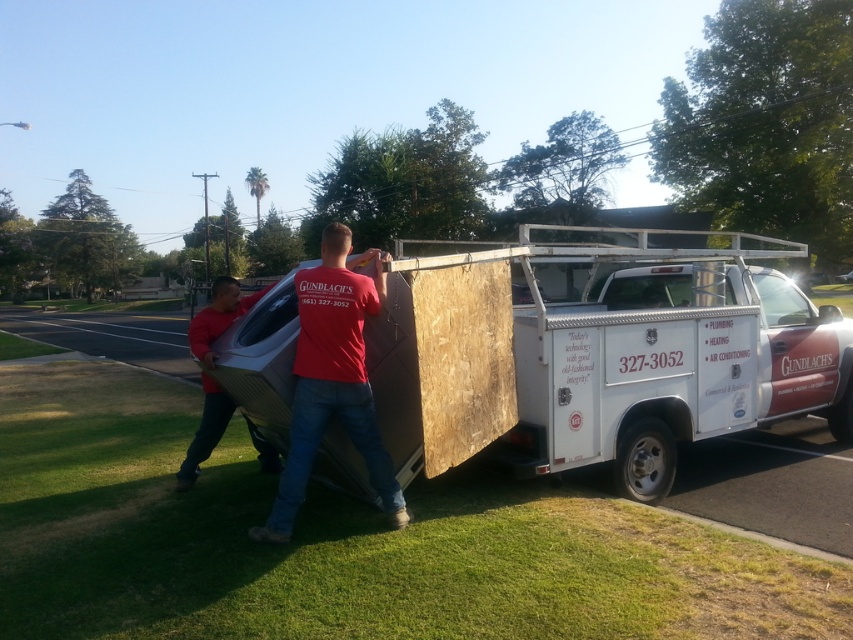
In the scene shown: You are standing at the scene and want to know the distance between the white matte truck at center and the red matte shirt at center. Can you estimate how far apart they are?

The white matte truck at center is 11.69 meters away from the red matte shirt at center.

You are a delivery person who needs to ensure that both workers are wearing shirts of sufficient width to handle the heavy appliance safely. According to the safety guidelines, each worker must have a shirt width of at least 40 cm. Can both workers with the red matte shirt at center and matte red shirt at center meet this requirement?

The red matte shirt at center has a width less than the matte red shirt at center. Since the minimum required width is 40 cm, only the matte red shirt at center meets the requirement, while the red matte shirt at center does not. Therefore, only the worker with the matte red shirt at center meets the safety guideline.

You are standing at the point marked by the coordinate point at (598,356). What object is located exactly at that point?

The white matte truck at center is located exactly at the point marked by the coordinate point at (598,356).